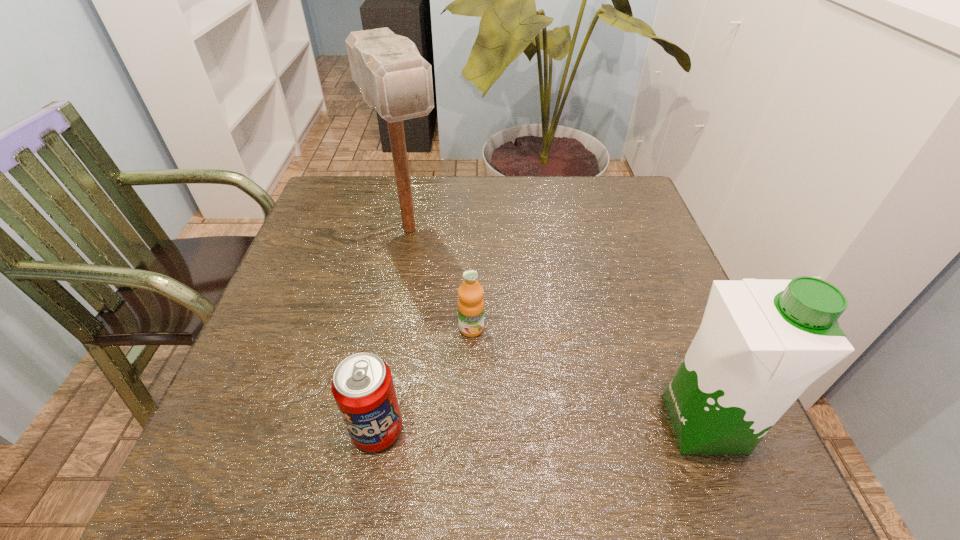
I want to click on vacant spot on the desktop that is between the soda can and the rightmost object and is positioned above the head of the mallet, so click(529, 427).

Where is `free spot on the desktop that is between the soda can and the soya milk and is positioned on the label of the second object from right to left`? This screenshot has width=960, height=540. free spot on the desktop that is between the soda can and the soya milk and is positioned on the label of the second object from right to left is located at coordinates (495, 427).